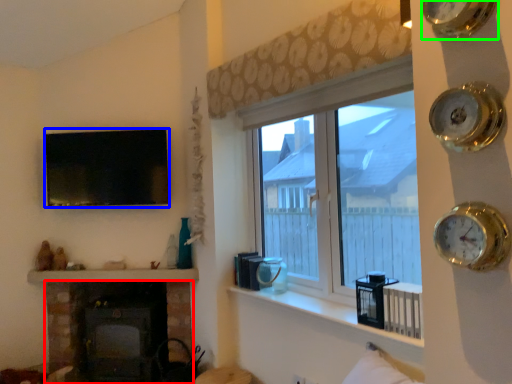
Question: Considering the real-world distances, which object is closest to wood burning stove (highlighted by a red box)? picture frame (highlighted by a blue box) or clock (highlighted by a green box).

Choices:
 (A) picture frame
 (B) clock

Answer: (A)